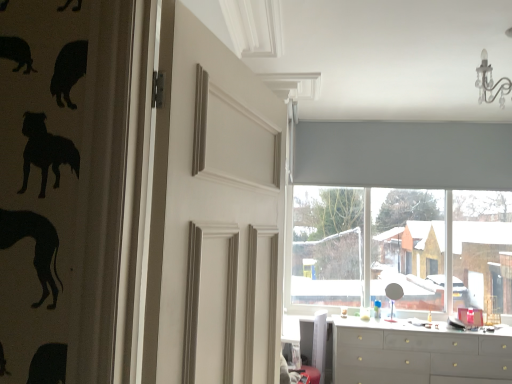
Question: From a real-world perspective, is matte gray roller blind at upper center on top of white matte door at center?

Choices:
 (A) no
 (B) yes

Answer: (B)

Question: Considering the relative positions of matte gray roller blind at upper center and white matte door at center in the image provided, is matte gray roller blind at upper center in front of white matte door at center?

Choices:
 (A) yes
 (B) no

Answer: (B)

Question: From the image's perspective, is matte gray roller blind at upper center beneath white matte door at center?

Choices:
 (A) yes
 (B) no

Answer: (A)

Question: Is matte gray roller blind at upper center shorter than white matte door at center?

Choices:
 (A) yes
 (B) no

Answer: (B)

Question: Is matte gray roller blind at upper center in contact with white matte door at center?

Choices:
 (A) yes
 (B) no

Answer: (B)

Question: From a real-world perspective, is white glossy counter top at lower center positioned above or below gray fabric curtain at upper center?

Choices:
 (A) above
 (B) below

Answer: (B)

Question: Is white glossy counter top at lower center wider or thinner than gray fabric curtain at upper center?

Choices:
 (A) thin
 (B) wide

Answer: (B)

Question: Based on their sizes in the image, would you say white glossy counter top at lower center is bigger or smaller than gray fabric curtain at upper center?

Choices:
 (A) big
 (B) small

Answer: (B)

Question: In the image, is white glossy counter top at lower center positioned in front of or behind gray fabric curtain at upper center?

Choices:
 (A) front
 (B) behind

Answer: (A)

Question: From a real-world perspective, is white matte door at center positioned above or below matte gray roller blind at upper center?

Choices:
 (A) above
 (B) below

Answer: (B)

Question: Considering the positions of white matte door at center and matte gray roller blind at upper center in the image, is white matte door at center wider or thinner than matte gray roller blind at upper center?

Choices:
 (A) wide
 (B) thin

Answer: (A)

Question: From the image's perspective, relative to matte gray roller blind at upper center, is white matte door at center above or below?

Choices:
 (A) below
 (B) above

Answer: (B)

Question: In terms of size, does white matte door at center appear bigger or smaller than matte gray roller blind at upper center?

Choices:
 (A) big
 (B) small

Answer: (B)

Question: Considering the positions of matte gray dresser at lower right and matte gray roller blind at upper center in the image, is matte gray dresser at lower right wider or thinner than matte gray roller blind at upper center?

Choices:
 (A) thin
 (B) wide

Answer: (B)

Question: In terms of size, does matte gray dresser at lower right appear bigger or smaller than matte gray roller blind at upper center?

Choices:
 (A) big
 (B) small

Answer: (B)